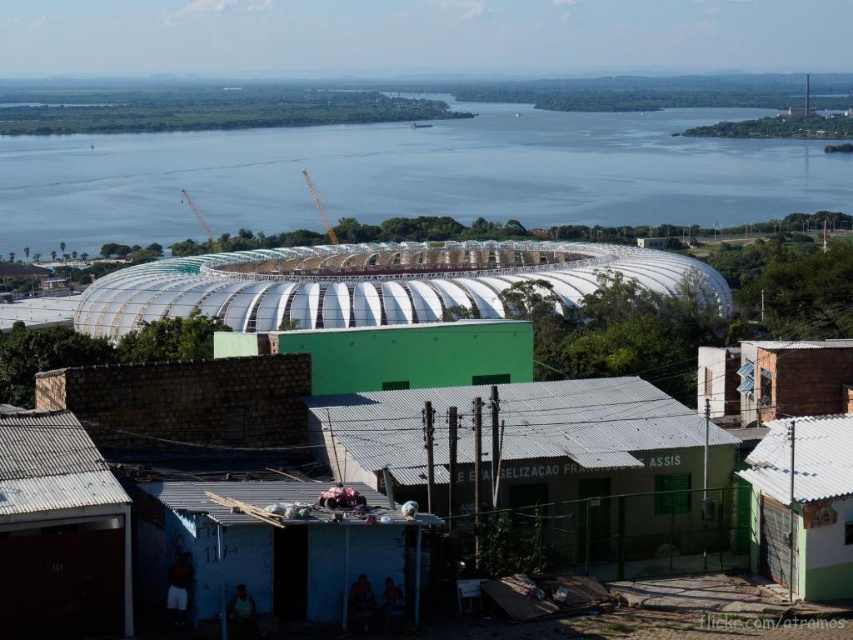
Between white translucent dome at center and blue water at center, which one has less height?

white translucent dome at center is shorter.

Is white translucent dome at center positioned at the back of blue water at center?

No, it is not.

The height and width of the screenshot is (640, 853). What do you see at coordinates (511, 378) in the screenshot?
I see `white translucent dome at center` at bounding box center [511, 378].

The image size is (853, 640). Find the location of `white translucent dome at center`. white translucent dome at center is located at coordinates (511, 378).